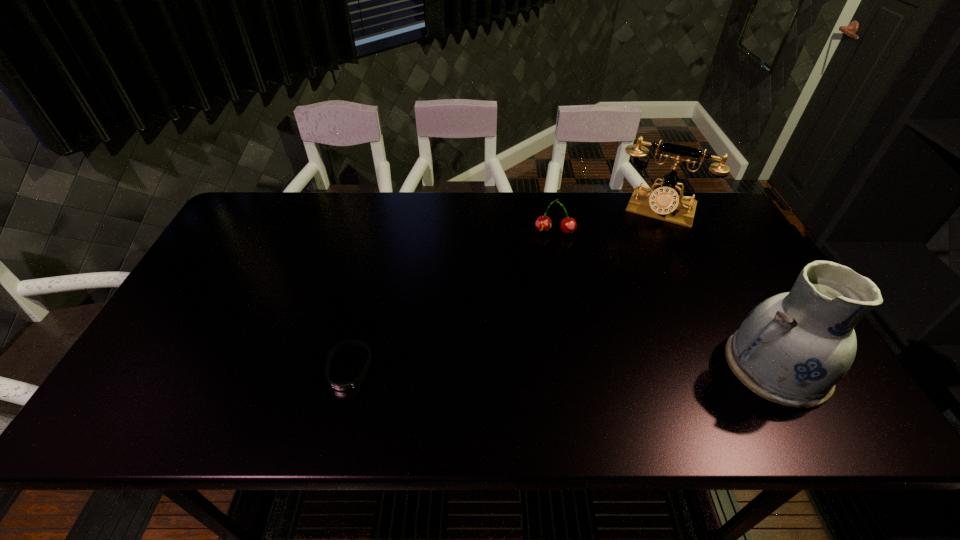
At what (x,y) coordinates should I click in order to perform the action: click on vacant spot on the desktop that is between the shortest object and the tallest object and is positioned with stems pointing upwards on the second object from left to right. Please return your answer as a coordinate pair (x, y). The image size is (960, 540). Looking at the image, I should click on (551, 367).

What are the coordinates of `vacant space on the desktop that is between the wristband and the pottery and is positioned on the dial of the telephone` in the screenshot? It's located at (608, 367).